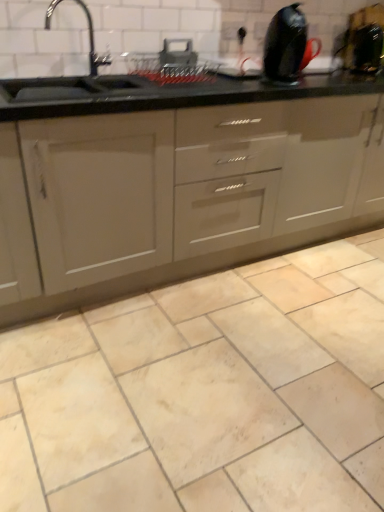
Locate an element on the screen. free location above beige marble tile at center (from a real-world perspective) is located at coordinates (241, 330).